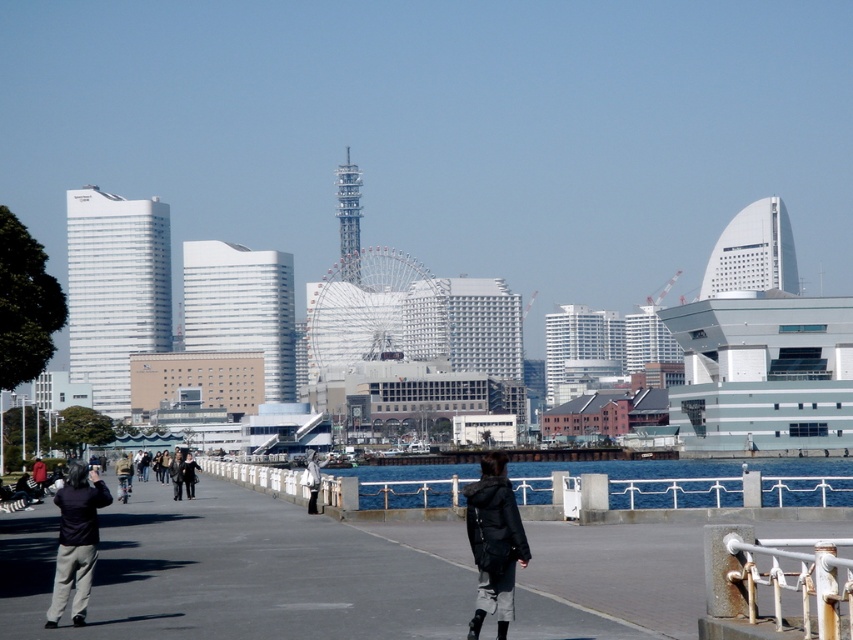
Question: Among these objects, which one is farthest from the camera?

Choices:
 (A) smooth concrete walkway at center
 (B) dark gray pants at lower left
 (C) black matte jacket at center
 (D) rusty metal rail at lower right

Answer: (B)

Question: Is smooth concrete walkway at center to the left of dark gray pants at lower left from the viewer's perspective?

Choices:
 (A) no
 (B) yes

Answer: (A)

Question: Does rusty metal rail at lower right lie behind black matte jacket at center?

Choices:
 (A) yes
 (B) no

Answer: (B)

Question: Which point is closer to the camera?

Choices:
 (A) dark gray pants at lower left
 (B) rusty metal rail at lower right
 (C) black matte jacket at center

Answer: (B)

Question: Which object is the farthest from the smooth concrete walkway at center?

Choices:
 (A) rusty metal rail at lower right
 (B) dark gray pants at lower left

Answer: (A)

Question: Is smooth concrete walkway at center below black matte jacket at center?

Choices:
 (A) no
 (B) yes

Answer: (B)